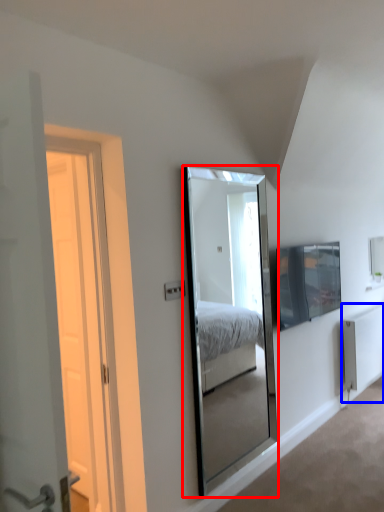
Question: Which object appears closest to the camera in this image, mirror (highlighted by a red box) or radiator (highlighted by a blue box)?

Choices:
 (A) mirror
 (B) radiator

Answer: (A)